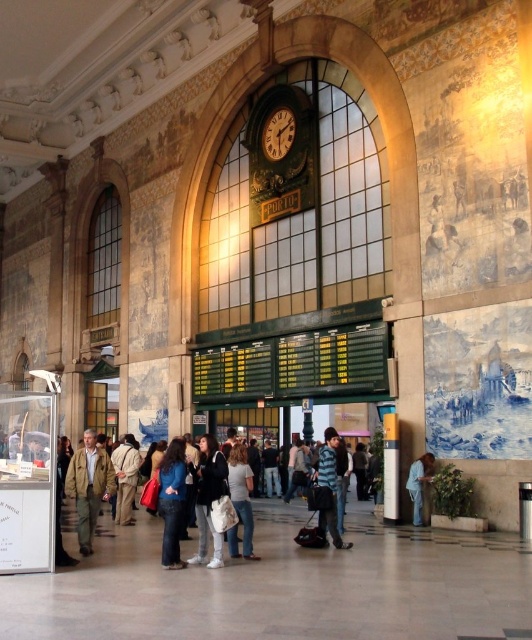
Question: Is dark blue jeans at center further to the viewer compared to blue fabric shirt at lower right?

Choices:
 (A) yes
 (B) no

Answer: (B)

Question: Which point is closer to the camera?

Choices:
 (A) denim jacket at center
 (B) striped shirt at center

Answer: (A)

Question: Among these objects, which one is farthest from the camera?

Choices:
 (A) light brown leather jacket at center
 (B) blue fabric shirt at lower right
 (C) khaki cotton pants at lower left

Answer: (A)

Question: Is denim jacket at center below light gray cotton shirt at center?

Choices:
 (A) yes
 (B) no

Answer: (A)

Question: Is dark blue jeans at center bigger than matte gold clock at center?

Choices:
 (A) yes
 (B) no

Answer: (A)

Question: Which point is closer to the camera?

Choices:
 (A) black leather jacket at center
 (B) matte gold clock at center
 (C) denim jacket at center

Answer: (A)